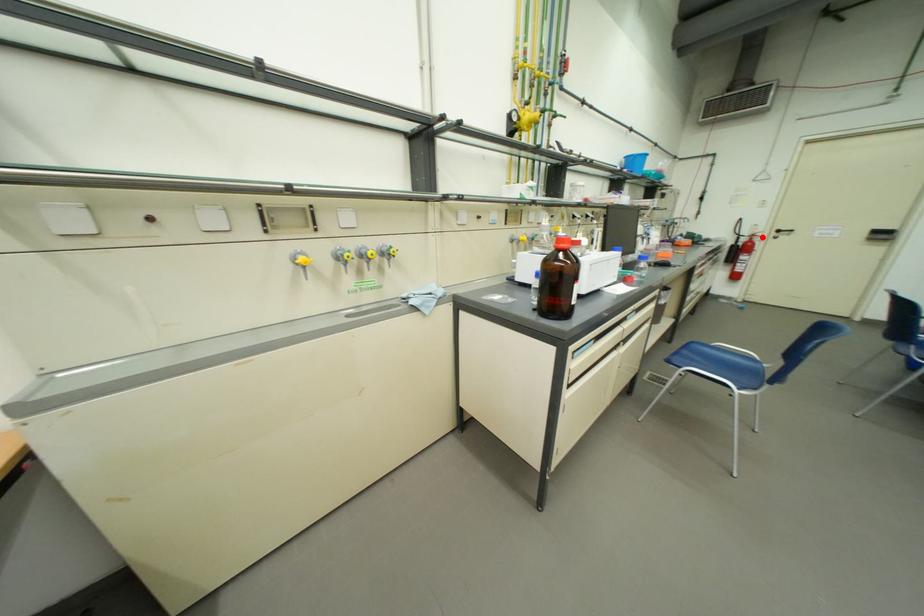
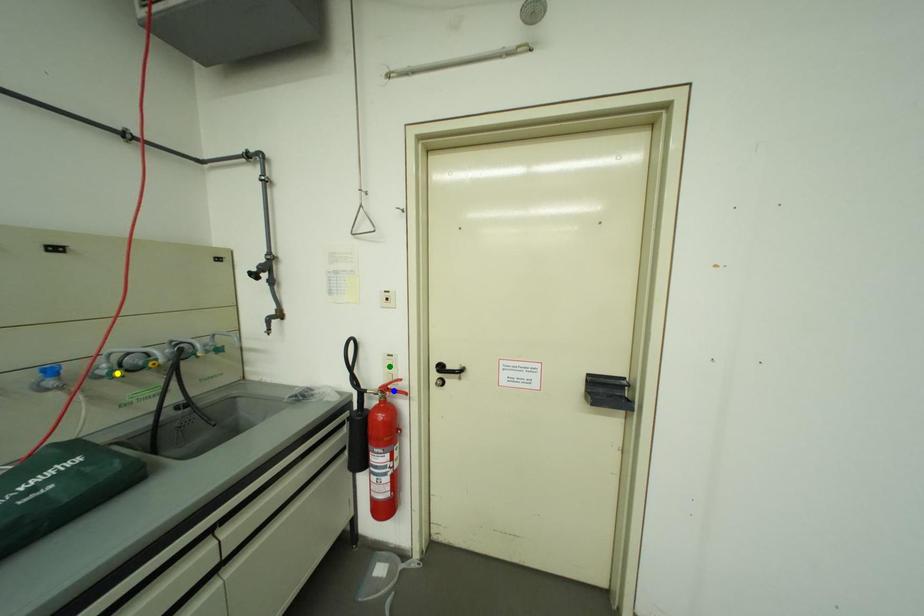
Question: I am providing you with two images of the same scene from different viewpoints. A red point is marked on the first image. You are given multiple points on the second image. Which spot in image 2 lines up with the point in image 1?

Choices:
 (A) yellow point
 (B) green point
 (C) blue point

Answer: (C)